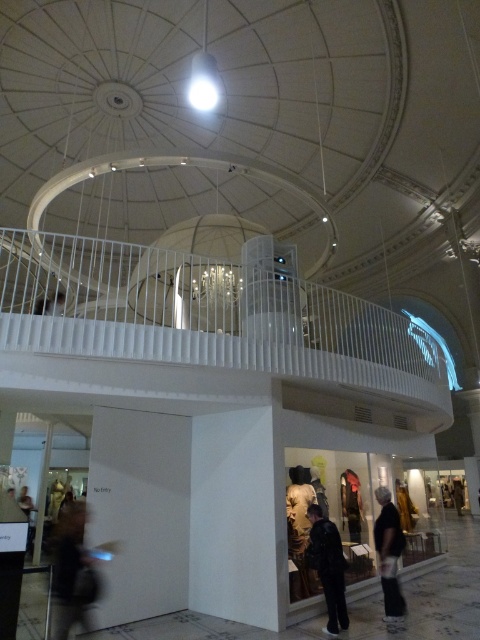
Is dark gray backpack at lower left to the left of black leather jacket at lower center from the viewer's perspective?

Yes, dark gray backpack at lower left is to the left of black leather jacket at lower center.

Between dark gray backpack at lower left and black leather jacket at lower center, which one is positioned higher?

dark gray backpack at lower left is above.

Is point (64, 625) in front of point (333, 528)?

Yes, it is in front of point (333, 528).

The image size is (480, 640). Identify the location of dark gray backpack at lower left. (72, 570).

Who is more distant from viewer, (90, 579) or (383, 538)?

Point (383, 538)

Can you confirm if dark gray backpack at lower left is bigger than dark gray fabric jacket at lower center?

Yes, dark gray backpack at lower left is bigger than dark gray fabric jacket at lower center.

The image size is (480, 640). Describe the element at coordinates (72, 570) in the screenshot. I see `dark gray backpack at lower left` at that location.

Image resolution: width=480 pixels, height=640 pixels. What are the coordinates of `dark gray backpack at lower left` in the screenshot? It's located at (72, 570).

Between black leather jacket at lower center and dark gray fabric jacket at lower center, which one appears on the right side from the viewer's perspective?

Positioned to the right is dark gray fabric jacket at lower center.

Can you confirm if black leather jacket at lower center is positioned to the left of dark gray fabric jacket at lower center?

Yes, black leather jacket at lower center is to the left of dark gray fabric jacket at lower center.

Find the location of a particular element. The width and height of the screenshot is (480, 640). black leather jacket at lower center is located at coordinates (327, 566).